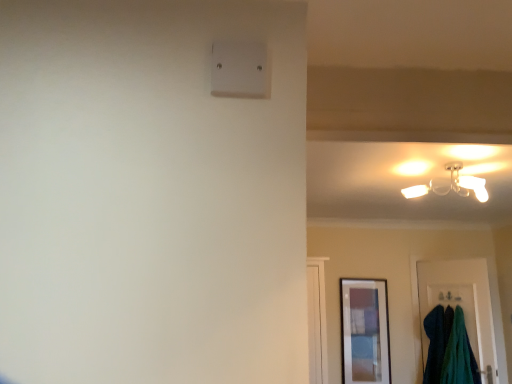
Find the location of a particular element. The height and width of the screenshot is (384, 512). teal fabric door at lower right is located at coordinates (463, 303).

In order to click on wooden framed picture at lower right in this screenshot , I will do `click(365, 331)`.

Find the location of a particular element. teal fabric door at lower right is located at coordinates (463, 303).

At what (x,y) coordinates should I click in order to perform the action: click on light switch above the wooden framed picture at lower right (from a real-world perspective). Please return your answer as a coordinate pair (x, y). Looking at the image, I should click on (240, 70).

From a real-world perspective, is white plastic light switch at upper center under wooden framed picture at lower right?

Incorrect, from a real-world perspective, white plastic light switch at upper center is higher than wooden framed picture at lower right.

Which is in front, white plastic light switch at upper center or wooden framed picture at lower right?

white plastic light switch at upper center is closer to the camera.

Would you say velvety teal towels at lower right is inside or outside matte white ceiling light at upper right?

velvety teal towels at lower right is not inside matte white ceiling light at upper right, it's outside.

Considering the positions of point (464, 370) and point (477, 189), is point (464, 370) closer or farther from the camera than point (477, 189)?

Point (464, 370) appears to be farther away from the viewer than point (477, 189).

Is velvety teal towels at lower right with matte white ceiling light at upper right?

No, velvety teal towels at lower right is not with matte white ceiling light at upper right.

How different are the orientations of velvety teal towels at lower right and matte white ceiling light at upper right in degrees?

velvety teal towels at lower right and matte white ceiling light at upper right are facing 69.8 degrees away from each other.

Could you tell me if matte white ceiling light at upper right is turned towards wooden framed picture at lower right?

No, matte white ceiling light at upper right is not turned towards wooden framed picture at lower right.

How much distance is there between matte white ceiling light at upper right and wooden framed picture at lower right?

matte white ceiling light at upper right is 1.71 meters from wooden framed picture at lower right.

Is wooden framed picture at lower right located within matte white ceiling light at upper right?

No, matte white ceiling light at upper right does not contain wooden framed picture at lower right.

This screenshot has width=512, height=384. In the image, there is a wooden framed picture at lower right. In order to click on lamp above it (from the image's perspective) in this screenshot , I will do `click(452, 185)`.

Considering the relative sizes of white plastic light switch at upper center and matte white ceiling light at upper right in the image provided, is white plastic light switch at upper center wider than matte white ceiling light at upper right?

No.

Does white plastic light switch at upper center come behind matte white ceiling light at upper right?

No, it is in front of matte white ceiling light at upper right.

Is velvety teal towels at lower right facing towards wooden framed picture at lower right?

No, velvety teal towels at lower right is not aimed at wooden framed picture at lower right.

The width and height of the screenshot is (512, 384). What are the coordinates of `laundry below the wooden framed picture at lower right (from a real-world perspective)` in the screenshot? It's located at (449, 348).

Is velvety teal towels at lower right taller or shorter than wooden framed picture at lower right?

Considering their sizes, velvety teal towels at lower right has less height than wooden framed picture at lower right.

Is teal fabric door at lower right bigger than velvety teal towels at lower right?

Incorrect, teal fabric door at lower right is not larger than velvety teal towels at lower right.

From the image's perspective, is teal fabric door at lower right above velvety teal towels at lower right?

Yes, from the image's perspective, teal fabric door at lower right is on top of velvety teal towels at lower right.

Considering the points (478, 346) and (443, 341), which point is in front, point (478, 346) or point (443, 341)?

The point (478, 346) is closer.

From a real-world perspective, is teal fabric door at lower right under velvety teal towels at lower right?

Actually, teal fabric door at lower right is physically above velvety teal towels at lower right in the real world.

Does velvety teal towels at lower right touch teal fabric door at lower right?

No, velvety teal towels at lower right is not beside teal fabric door at lower right.

You are a GUI agent. You are given a task and a screenshot of the screen. Output one action in this format:
    pyautogui.click(x=<x>, y=<y>)
    Task: Click on the door that is above the velvety teal towels at lower right (from the image's perspective)
    The image size is (512, 384).
    Given the screenshot: What is the action you would take?
    pyautogui.click(x=463, y=303)

Looking at this image, from the image's perspective, is velvety teal towels at lower right on top of teal fabric door at lower right?

No, from the image's perspective, velvety teal towels at lower right is not on top of teal fabric door at lower right.

Is velvety teal towels at lower right in front of or behind teal fabric door at lower right in the image?

Clearly, velvety teal towels at lower right is in front of teal fabric door at lower right.

Where is `picture frame that is below the white plastic light switch at upper center (from the image's perspective)`? The image size is (512, 384). picture frame that is below the white plastic light switch at upper center (from the image's perspective) is located at coordinates (365, 331).

Image resolution: width=512 pixels, height=384 pixels. I want to click on lamp in front of the velvety teal towels at lower right, so click(452, 185).

From the image, which object appears to be nearer to white plastic light switch at upper center, teal fabric door at lower right or wooden framed picture at lower right?

teal fabric door at lower right is closer to white plastic light switch at upper center.

Looking at the image, which one is located closer to velvety teal towels at lower right, matte white ceiling light at upper right or white plastic light switch at upper center?

matte white ceiling light at upper right is closer to velvety teal towels at lower right.

Estimate the real-world distances between objects in this image. Which object is closer to teal fabric door at lower right, white plastic light switch at upper center or wooden framed picture at lower right?

wooden framed picture at lower right is positioned closer to the anchor teal fabric door at lower right.

Which object lies further to the anchor point wooden framed picture at lower right, white plastic light switch at upper center or velvety teal towels at lower right?

Among the two, white plastic light switch at upper center is located further to wooden framed picture at lower right.

Based on their spatial positions, is matte white ceiling light at upper right or white plastic light switch at upper center further from teal fabric door at lower right?

Among the two, white plastic light switch at upper center is located further to teal fabric door at lower right.

Based on their spatial positions, is matte white ceiling light at upper right or white plastic light switch at upper center further from wooden framed picture at lower right?

Based on the image, white plastic light switch at upper center appears to be further to wooden framed picture at lower right.

In the scene shown: Looking at the image, which one is located closer to matte white ceiling light at upper right, white plastic light switch at upper center or teal fabric door at lower right?

The object closer to matte white ceiling light at upper right is teal fabric door at lower right.

Considering their positions, is wooden framed picture at lower right positioned closer to velvety teal towels at lower right than matte white ceiling light at upper right?

Based on the image, wooden framed picture at lower right appears to be nearer to velvety teal towels at lower right.

At what (x,y) coordinates should I click in order to perform the action: click on laundry between white plastic light switch at upper center and wooden framed picture at lower right in the front-back direction. Please return your answer as a coordinate pair (x, y). This screenshot has height=384, width=512. Looking at the image, I should click on (449, 348).

The width and height of the screenshot is (512, 384). I want to click on lamp between white plastic light switch at upper center and wooden framed picture at lower right along the z-axis, so click(452, 185).

Locate an element on the screen. The width and height of the screenshot is (512, 384). lamp between white plastic light switch at upper center and teal fabric door at lower right in the front-back direction is located at coordinates (452, 185).

Where is `door located between white plastic light switch at upper center and wooden framed picture at lower right in the depth direction`? Image resolution: width=512 pixels, height=384 pixels. door located between white plastic light switch at upper center and wooden framed picture at lower right in the depth direction is located at coordinates (463, 303).